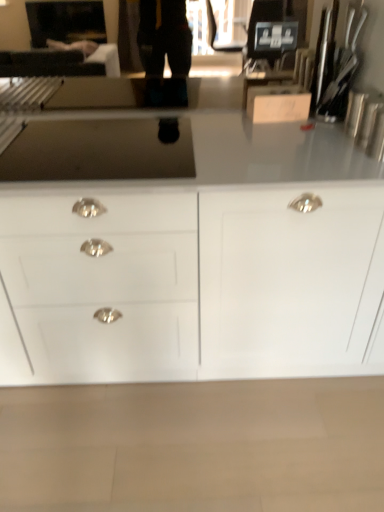
Where is `free space above white glossy cabinet at center (from a real-world perspective)`? The image size is (384, 512). free space above white glossy cabinet at center (from a real-world perspective) is located at coordinates (155, 144).